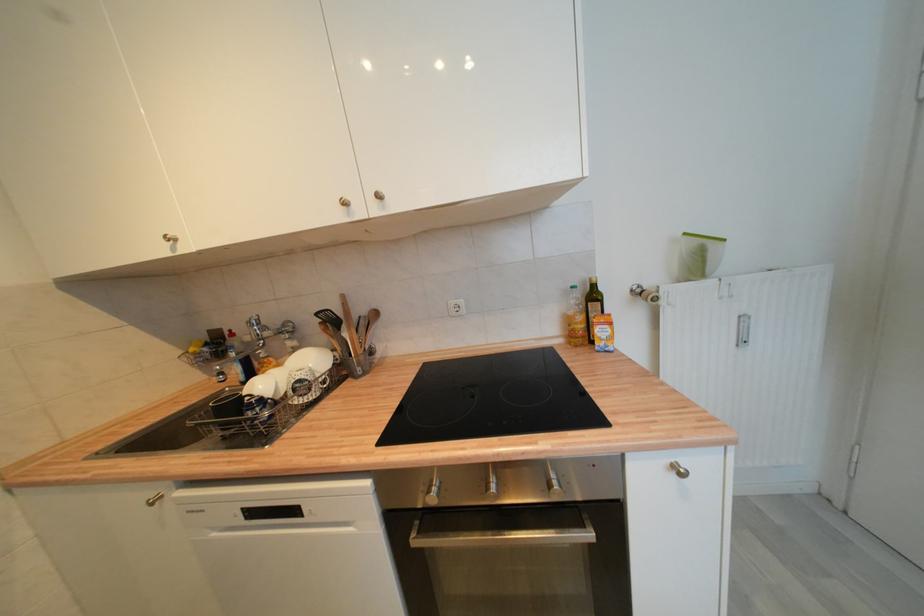
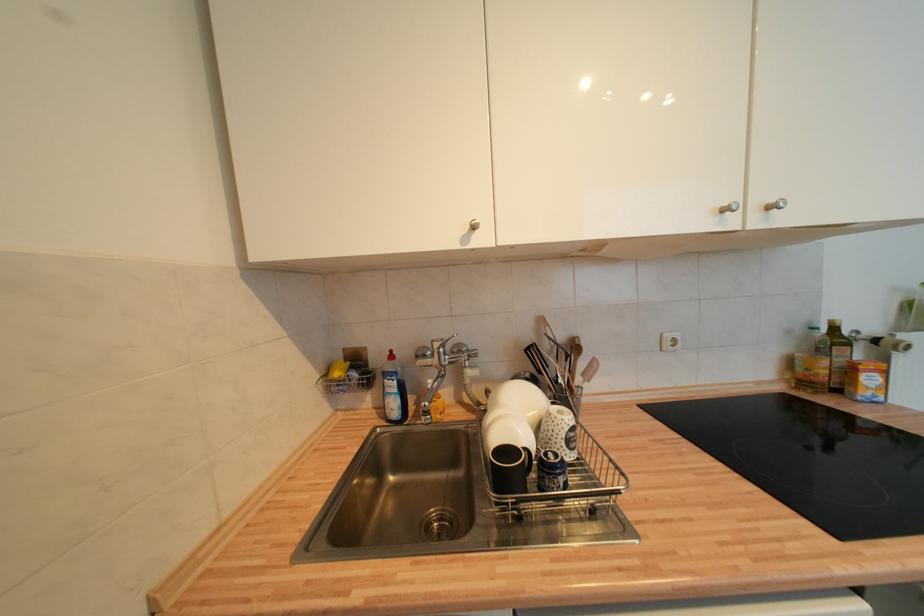
Where in the second image is the point corresponding to the point at 599,288 from the first image?

(840, 331)